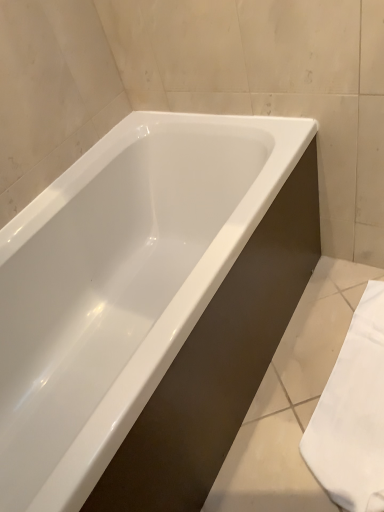
In order to face white fabric towel at lower right, should I rotate leftwards or rightwards?

Rotate right and turn 22.970 degrees.

At what (x,y) coordinates should I click in order to perform the action: click on white fabric towel at lower right. Please return your answer as a coordinate pair (x, y). This screenshot has width=384, height=512. Looking at the image, I should click on (353, 414).

The image size is (384, 512). What do you see at coordinates (353, 414) in the screenshot?
I see `white fabric towel at lower right` at bounding box center [353, 414].

Locate an element on the screen. This screenshot has width=384, height=512. white glossy bathtub at center is located at coordinates click(149, 307).

What is the approximate height of white glossy bathtub at center?

→ white glossy bathtub at center is 58.38 centimeters tall.

What do you see at coordinates (149, 307) in the screenshot? This screenshot has height=512, width=384. I see `white glossy bathtub at center` at bounding box center [149, 307].

I want to click on white fabric towel at lower right, so click(x=353, y=414).

Would you say white glossy bathtub at center is to the left or to the right of white fabric towel at lower right in the picture?

white glossy bathtub at center is positioned on white fabric towel at lower right's left side.

Is the position of white glossy bathtub at center more distant than that of white fabric towel at lower right?

No.

Considering the points (105, 205) and (319, 478), which point is in front, point (105, 205) or point (319, 478)?

The point (319, 478) is in front.

From the image's perspective, is white glossy bathtub at center below white fabric towel at lower right?

Incorrect, from the image's perspective, white glossy bathtub at center is higher than white fabric towel at lower right.

From a real-world perspective, who is located higher, white glossy bathtub at center or white fabric towel at lower right?

white glossy bathtub at center.

Looking at their sizes, would you say white glossy bathtub at center is wider or thinner than white fabric towel at lower right?

Clearly, white glossy bathtub at center has more width compared to white fabric towel at lower right.

Can you confirm if white glossy bathtub at center is shorter than white fabric towel at lower right?

Incorrect, the height of white glossy bathtub at center does not fall short of that of white fabric towel at lower right.

Considering the relative sizes of white glossy bathtub at center and white fabric towel at lower right in the image provided, is white glossy bathtub at center smaller than white fabric towel at lower right?

Incorrect, white glossy bathtub at center is not smaller in size than white fabric towel at lower right.

Which is correct: white glossy bathtub at center is inside white fabric towel at lower right, or outside of it?

white glossy bathtub at center is spatially situated outside white fabric towel at lower right.

Is white glossy bathtub at center far away from white fabric towel at lower right?

No.

Is white glossy bathtub at center oriented away from white fabric towel at lower right?

No, white glossy bathtub at center is not facing away from white fabric towel at lower right.

Consider the image. How different are the orientations of white glossy bathtub at center and white fabric towel at lower right in degrees?

5.05e-05 degrees.

How distant is white glossy bathtub at center from white fabric towel at lower right?

A distance of 20.86 inches exists between white glossy bathtub at center and white fabric towel at lower right.

Image resolution: width=384 pixels, height=512 pixels. Find the location of `bathtub located above the white fabric towel at lower right (from the image's perspective)`. bathtub located above the white fabric towel at lower right (from the image's perspective) is located at coordinates 149,307.

Is white fabric towel at lower right to the left or to the right of white glossy bathtub at center in the image?

Clearly, white fabric towel at lower right is on the right of white glossy bathtub at center in the image.

In the scene shown: Who is more distant, white fabric towel at lower right or white glossy bathtub at center?

white fabric towel at lower right.

Does point (356, 482) come closer to viewer compared to point (188, 480)?

No.

From the image's perspective, does white fabric towel at lower right appear higher than white glossy bathtub at center?

No, from the image's perspective, white fabric towel at lower right is not over white glossy bathtub at center.

From a real-world perspective, does white fabric towel at lower right sit lower than white glossy bathtub at center?

Indeed, from a real-world perspective, white fabric towel at lower right is positioned beneath white glossy bathtub at center.

Is white fabric towel at lower right wider than white glossy bathtub at center?

No.

Does white fabric towel at lower right have a lesser height compared to white glossy bathtub at center?

Indeed, white fabric towel at lower right has a lesser height compared to white glossy bathtub at center.

Looking at the image, does white fabric towel at lower right seem bigger or smaller compared to white glossy bathtub at center?

white fabric towel at lower right is smaller than white glossy bathtub at center.

Is white fabric towel at lower right not within white glossy bathtub at center?

Yes, white fabric towel at lower right is outside of white glossy bathtub at center.

Is white fabric towel at lower right next to white glossy bathtub at center and touching it?

white fabric towel at lower right and white glossy bathtub at center are clearly separated.

Is white fabric towel at lower right looking in the opposite direction of white glossy bathtub at center?

No, white fabric towel at lower right is not facing the opposite direction of white glossy bathtub at center.

You are a GUI agent. You are given a task and a screenshot of the screen. Output one action in this format:
    pyautogui.click(x=<x>, y=<y>)
    Task: Click on the bathtub in front of the white fabric towel at lower right
    This screenshot has height=512, width=384.
    Given the screenshot: What is the action you would take?
    pyautogui.click(x=149, y=307)

This screenshot has height=512, width=384. I want to click on bathtub above the white fabric towel at lower right (from a real-world perspective), so click(x=149, y=307).

You are a GUI agent. You are given a task and a screenshot of the screen. Output one action in this format:
    pyautogui.click(x=<x>, y=<y>)
    Task: Click on the bath towel that appears below the white glossy bathtub at center (from a real-world perspective)
    The height and width of the screenshot is (512, 384).
    Given the screenshot: What is the action you would take?
    pyautogui.click(x=353, y=414)